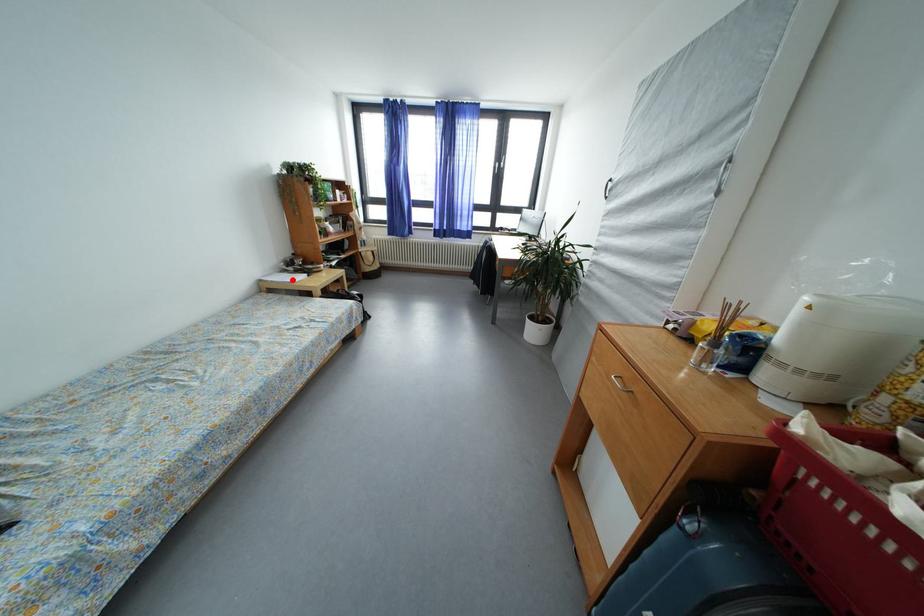
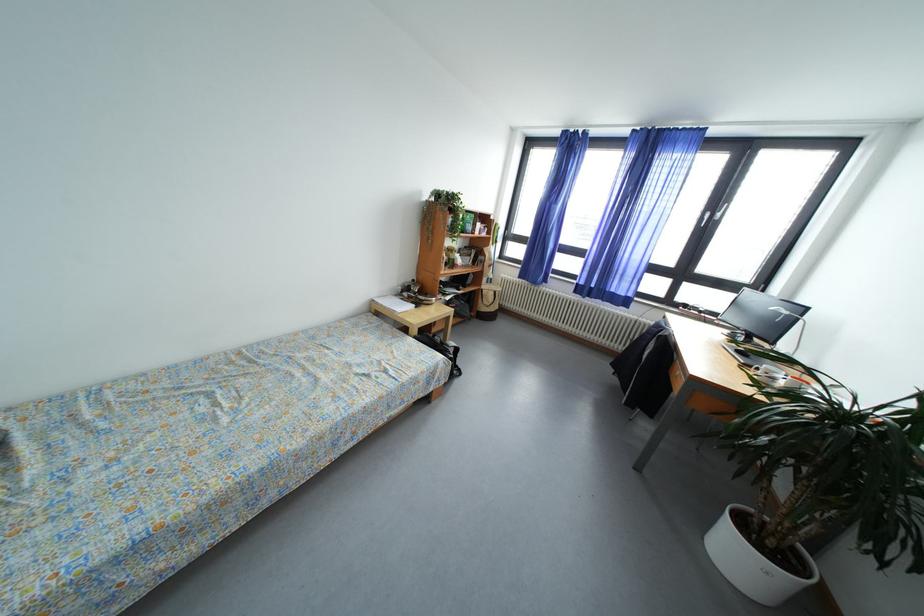
In the second image, find the point that corresponds to the highlighted location in the first image.

(405, 305)